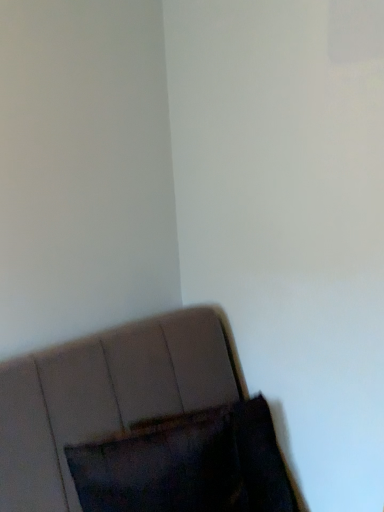
You are a GUI agent. You are given a task and a screenshot of the screen. Output one action in this format:
    pyautogui.click(x=<x>, y=<y>)
    Task: Click on the dark fabric pillow at lower right
    
    Given the screenshot: What is the action you would take?
    pyautogui.click(x=187, y=464)

The height and width of the screenshot is (512, 384). Describe the element at coordinates (187, 464) in the screenshot. I see `dark fabric pillow at lower right` at that location.

Find the location of `dark fabric pillow at lower right`. dark fabric pillow at lower right is located at coordinates (187, 464).